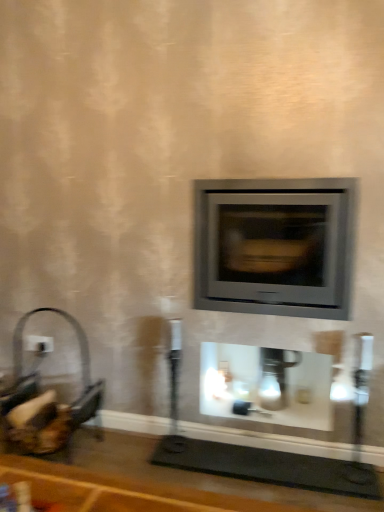
Question: Considering the relative sizes of matte gray wood burning stove at center and white plastic electric outlet at left in the image provided, is matte gray wood burning stove at center wider than white plastic electric outlet at left?

Choices:
 (A) no
 (B) yes

Answer: (B)

Question: Does matte gray wood burning stove at center touch white plastic electric outlet at left?

Choices:
 (A) no
 (B) yes

Answer: (A)

Question: Does matte gray wood burning stove at center appear on the right side of white plastic electric outlet at left?

Choices:
 (A) no
 (B) yes

Answer: (B)

Question: Is matte gray wood burning stove at center not close to white plastic electric outlet at left?

Choices:
 (A) yes
 (B) no

Answer: (A)

Question: From the image's perspective, is matte gray wood burning stove at center over white plastic electric outlet at left?

Choices:
 (A) no
 (B) yes

Answer: (B)

Question: Is the position of matte gray wood burning stove at center less distant than that of white plastic electric outlet at left?

Choices:
 (A) no
 (B) yes

Answer: (B)

Question: Is white plastic electric outlet at left not close to matte gray wood burning stove at center?

Choices:
 (A) no
 (B) yes

Answer: (B)

Question: Is white plastic electric outlet at left smaller than matte gray wood burning stove at center?

Choices:
 (A) yes
 (B) no

Answer: (A)

Question: From a real-world perspective, does white plastic electric outlet at left stand above matte gray wood burning stove at center?

Choices:
 (A) yes
 (B) no

Answer: (B)

Question: Can you confirm if white plastic electric outlet at left is wider than matte gray wood burning stove at center?

Choices:
 (A) no
 (B) yes

Answer: (A)

Question: Considering the relative positions of white plastic electric outlet at left and matte gray wood burning stove at center in the image provided, is white plastic electric outlet at left to the right of matte gray wood burning stove at center from the viewer's perspective?

Choices:
 (A) no
 (B) yes

Answer: (A)

Question: Is white plastic electric outlet at left shorter than matte gray wood burning stove at center?

Choices:
 (A) yes
 (B) no

Answer: (A)

Question: Is matte gray wood burning stove at center to the left of white glossy fireplace at center from the viewer's perspective?

Choices:
 (A) no
 (B) yes

Answer: (B)